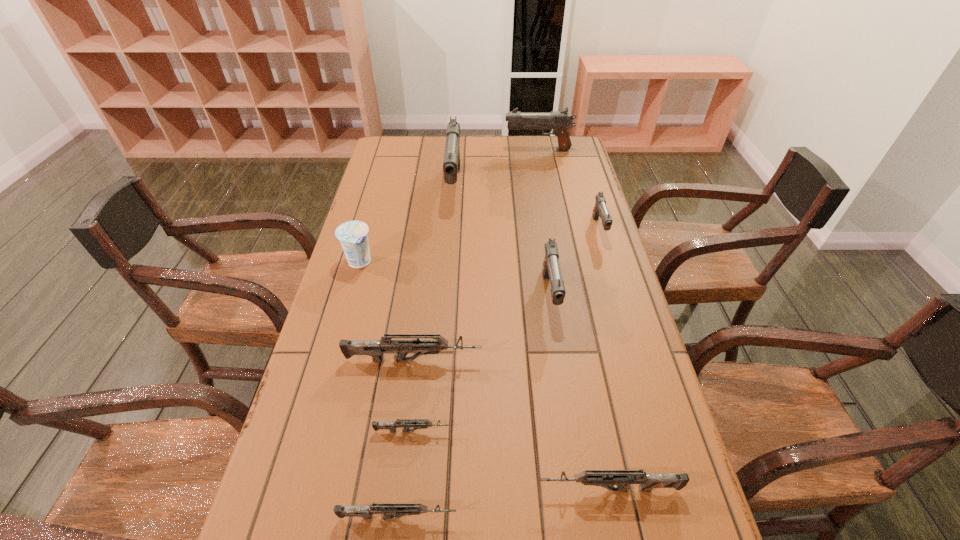
Identify the location of the farthest grey gun. This screenshot has width=960, height=540. tap(375, 348).

Where is `the third shortest object`? Image resolution: width=960 pixels, height=540 pixels. the third shortest object is located at coordinates (605, 478).

Locate an element on the screen. Image resolution: width=960 pixels, height=540 pixels. the rightmost grey gun is located at coordinates (605, 478).

The width and height of the screenshot is (960, 540). Identify the location of the nearest gun. click(388, 510).

This screenshot has height=540, width=960. I want to click on the seventh tallest gun, so click(388, 510).

Locate an element on the screen. The image size is (960, 540). the sixth farthest gun is located at coordinates (405, 423).

Locate an element on the screen. The height and width of the screenshot is (540, 960). the shortest gun is located at coordinates (405, 423).

Locate an element on the screen. The width and height of the screenshot is (960, 540). free space located 0.100m in the direction the tallest object is aimed is located at coordinates (451, 232).

Identify the location of free space located in the direction the farthest object is aimed. The image size is (960, 540). (417, 150).

At what (x,y) coordinates should I click in order to perform the action: click on vacant point located 0.320m in the direction the farthest object is aimed. Please return your answer as a coordinate pair (x, y). The image size is (960, 540). Looking at the image, I should click on (424, 150).